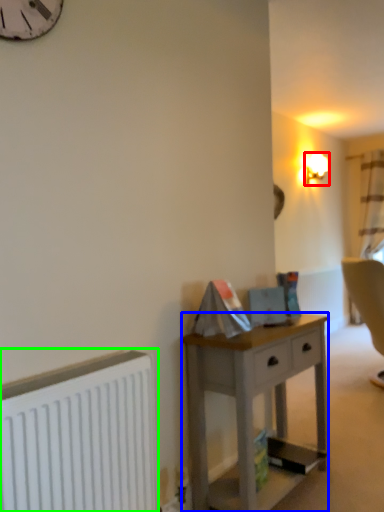
Question: Estimate the real-world distances between objects in this image. Which object is closer to lamp (highlighted by a red box), desk (highlighted by a blue box) or radiator (highlighted by a green box)?

Choices:
 (A) desk
 (B) radiator

Answer: (A)